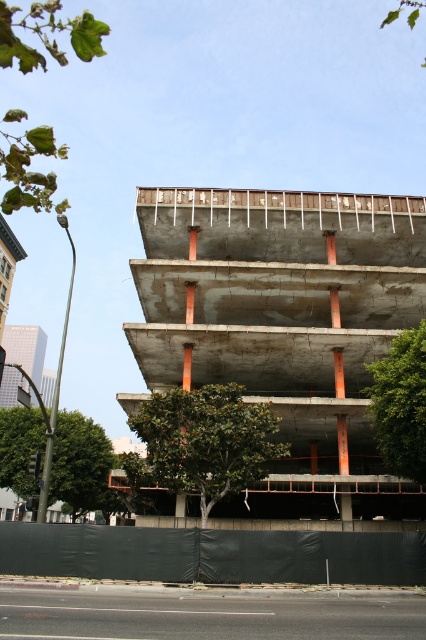
Question: Does green leafy tree at center appear on the left side of green leafy tree at lower left?

Choices:
 (A) yes
 (B) no

Answer: (B)

Question: Which object appears closest to the camera in this image?

Choices:
 (A) green leafy tree at upper left
 (B) green leafy tree at lower left
 (C) green leafy tree at center
 (D) green leafy tree at right

Answer: (A)

Question: Which point is farther from the camera taking this photo?

Choices:
 (A) (411, 362)
 (B) (63, 416)

Answer: (B)

Question: Does green leafy tree at lower left have a larger size compared to green leafy tree at right?

Choices:
 (A) yes
 (B) no

Answer: (A)

Question: Which point is closer to the camera taking this photo?

Choices:
 (A) (68, 420)
 (B) (229, 396)
 (C) (42, 61)

Answer: (C)

Question: Does green leafy tree at lower left have a larger size compared to green leafy tree at right?

Choices:
 (A) yes
 (B) no

Answer: (A)